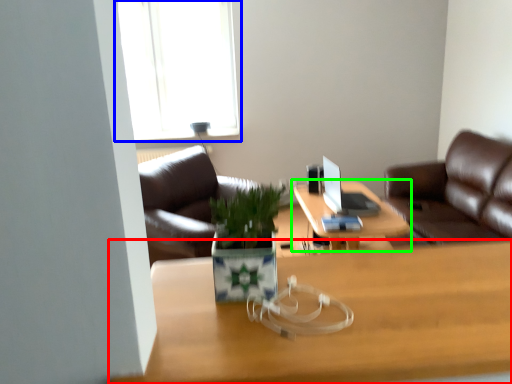
Question: Which object is the farthest from desk (highlighted by a red box)? Choose among these: window (highlighted by a blue box) or table (highlighted by a green box).

Choices:
 (A) window
 (B) table

Answer: (A)